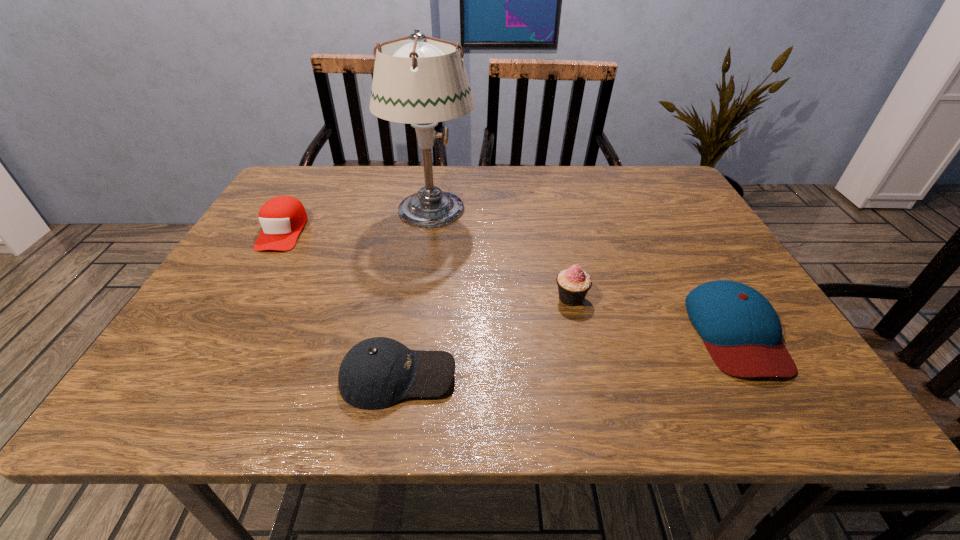
Select which object appears as the third closest to the rightmost baseball cap. Please provide its 2D coordinates. Your answer should be formatted as a tuple, i.e. [(x, y)], where the tuple contains the x and y coordinates of a point satisfying the conditions above.

[(421, 82)]

Identify which baseball cap is the second nearest to the second baseball cap from right to left. Please provide its 2D coordinates. Your answer should be formatted as a tuple, i.e. [(x, y)], where the tuple contains the x and y coordinates of a point satisfying the conditions above.

[(741, 330)]

The width and height of the screenshot is (960, 540). What are the coordinates of `baseball cap that stands as the closest to the rightmost object` in the screenshot? It's located at (376, 373).

The height and width of the screenshot is (540, 960). In order to click on vacant area that satisfies the following two spatial constraints: 1. with the bill of the rightmost baseball cap facing forward; 2. on the front-facing side of the second baseball cap from left to right in this screenshot , I will do `click(762, 376)`.

You are a GUI agent. You are given a task and a screenshot of the screen. Output one action in this format:
    pyautogui.click(x=<x>, y=<y>)
    Task: Click on the blank area in the image that satisfies the following two spatial constraints: 1. on the lampshade of the second object from right to left; 2. on the left side of the tallest object
    
    Given the screenshot: What is the action you would take?
    pyautogui.click(x=418, y=298)

This screenshot has width=960, height=540. I want to click on free region that satisfies the following two spatial constraints: 1. on the lampshade of the lampshade; 2. on the front-facing side of the leftmost baseball cap, so click(428, 231).